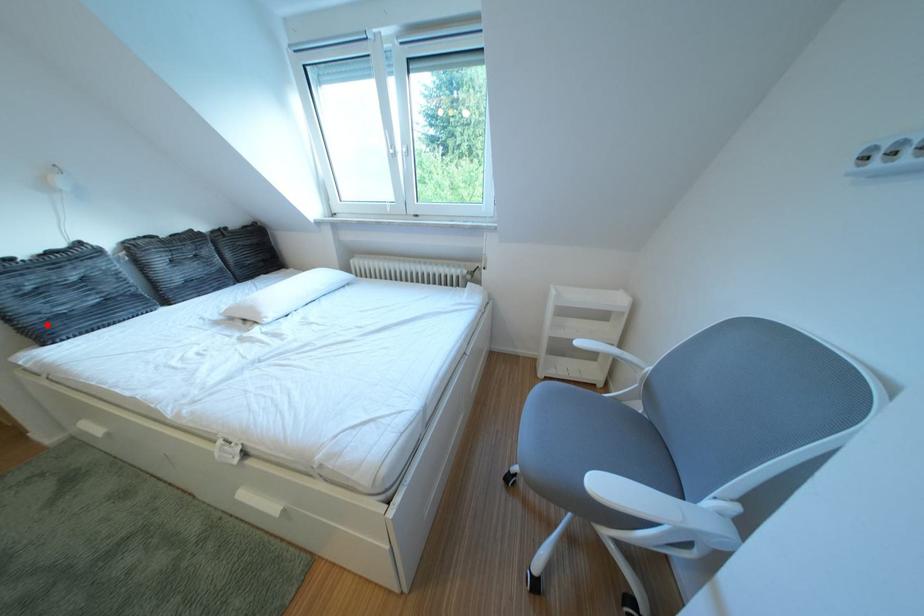
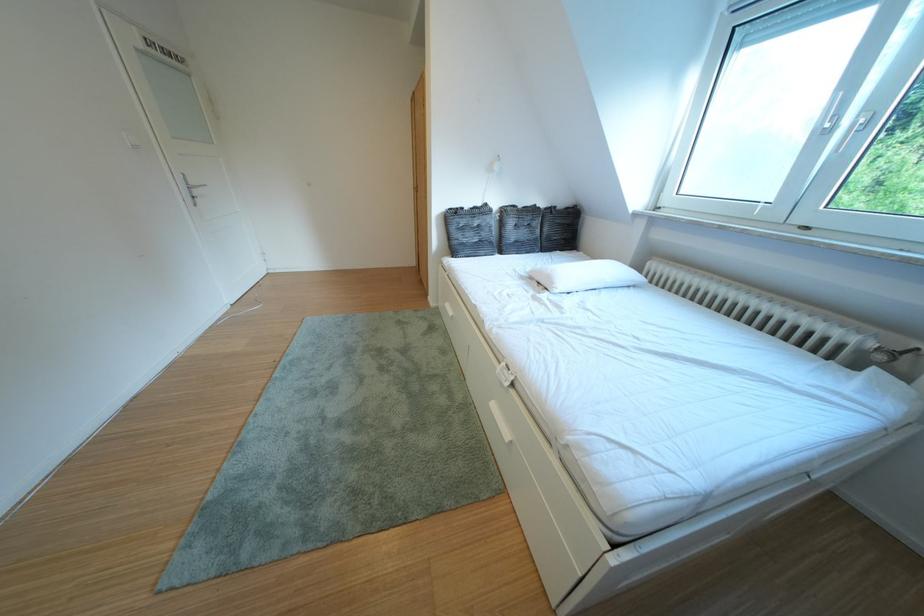
Find the pixel in the second image that matches the highlighted location in the first image.

(468, 246)